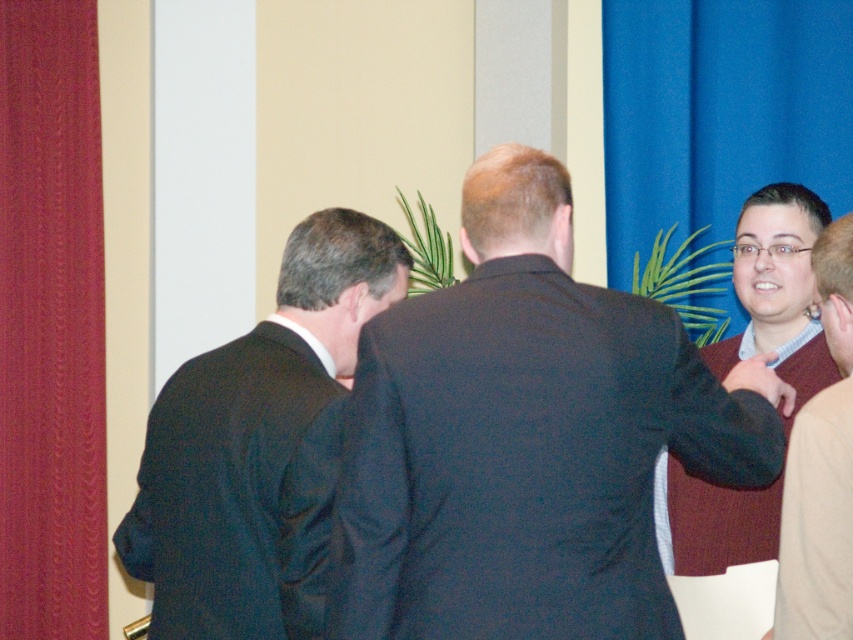
Is dark suit jacket at center above velvet-like red curtain at left?

Actually, dark suit jacket at center is below velvet-like red curtain at left.

Can you confirm if dark suit jacket at center is wider than velvet-like red curtain at left?

Correct, the width of dark suit jacket at center exceeds that of velvet-like red curtain at left.

Is point (440, 364) in front of point (83, 20)?

Yes, point (440, 364) is closer to viewer.

I want to click on dark suit jacket at center, so click(527, 436).

Between point (541, 428) and point (809, 352), which one is positioned in front?

Point (541, 428) is in front.

Does dark suit jacket at center appear under dark blue fabric business suit at right?

No, dark suit jacket at center is not below dark blue fabric business suit at right.

You are a GUI agent. You are given a task and a screenshot of the screen. Output one action in this format:
    pyautogui.click(x=<x>, y=<y>)
    Task: Click on the dark suit jacket at center
    
    Given the screenshot: What is the action you would take?
    pyautogui.click(x=527, y=436)

Can you confirm if dark suit jacket at center is taller than matte black suit at center?

Correct, dark suit jacket at center is much taller as matte black suit at center.

Is dark suit jacket at center closer to the viewer compared to matte black suit at center?

Yes, dark suit jacket at center is in front of matte black suit at center.

Is point (656, 568) closer to viewer compared to point (257, 548)?

That is True.

At what (x,y) coordinates should I click in order to perform the action: click on dark suit jacket at center. Please return your answer as a coordinate pair (x, y). Looking at the image, I should click on tap(527, 436).